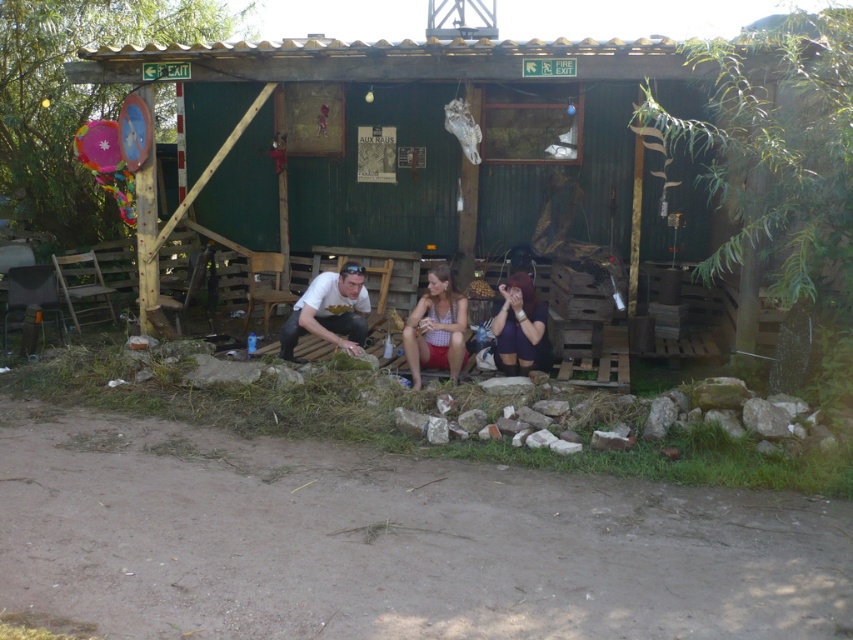
You are standing outside the rustic wooden hut and notice two items inside the hut. One is a white matte shirt at lower center and the other is a matte white tank top at center. Which item is closer to you?

The white matte shirt at lower center is closer to you because it is further to the viewer than the matte white tank top at center.

You are standing in front of the green wooden cabin at center and the matte white tank top at center. Which object is larger in size?

The matte white tank top at center is larger than the green wooden cabin at center.